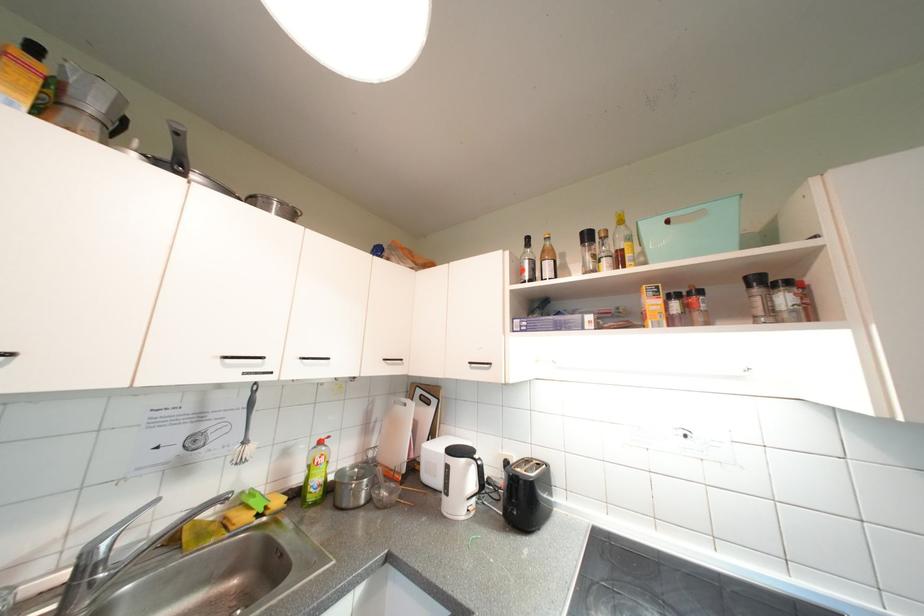
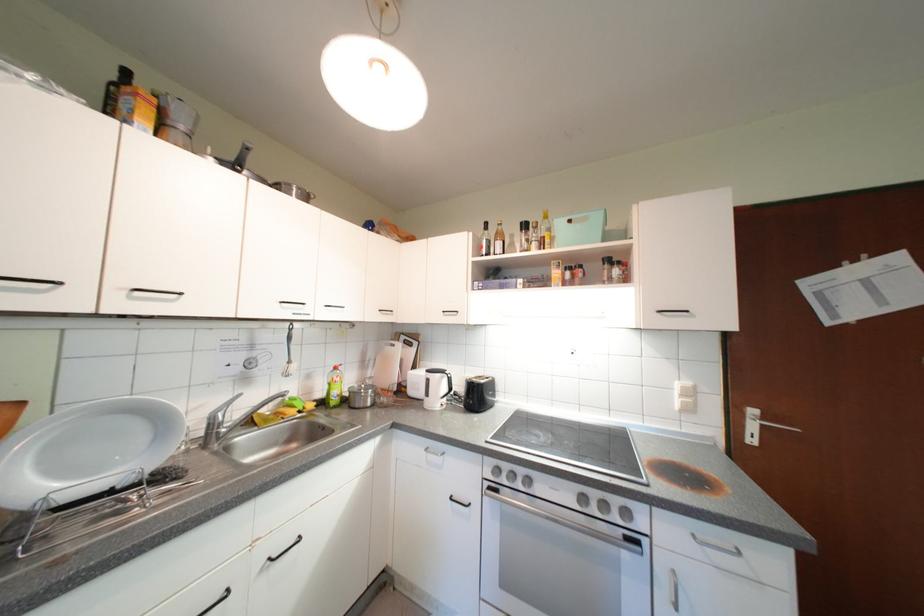
Locate, in the second image, the point that corresponds to pixel 321 474 in the first image.

(341, 389)